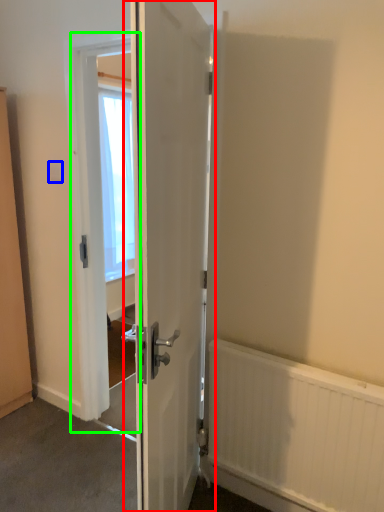
Question: Which object is positioned farthest from door (highlighted by a red box)? Select from electric outlet (highlighted by a blue box) and screen door (highlighted by a green box).

Choices:
 (A) electric outlet
 (B) screen door

Answer: (A)